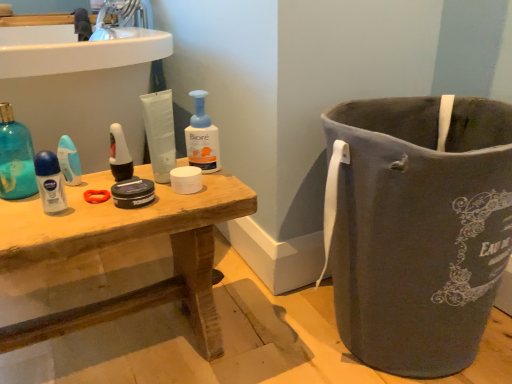
Where is `vacant area that is in front of translucent plastic deodorant stick at left, which ranks as the 1th cleaning product in left-to-right order`? Image resolution: width=512 pixels, height=384 pixels. vacant area that is in front of translucent plastic deodorant stick at left, which ranks as the 1th cleaning product in left-to-right order is located at coordinates (26, 213).